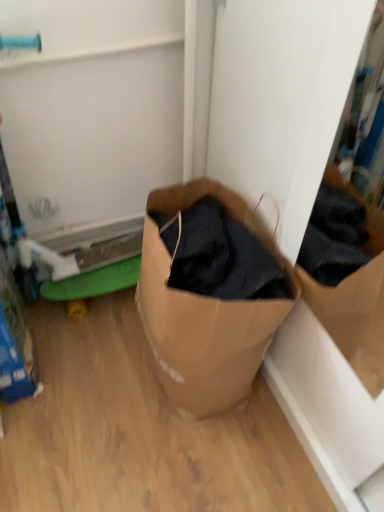
Question: Can you see brown paper bag at center touching green rubber toy at lower left?

Choices:
 (A) no
 (B) yes

Answer: (A)

Question: Considering the relative sizes of brown paper bag at center and green rubber toy at lower left in the image provided, is brown paper bag at center smaller than green rubber toy at lower left?

Choices:
 (A) yes
 (B) no

Answer: (B)

Question: From a real-world perspective, is brown paper bag at center physically below green rubber toy at lower left?

Choices:
 (A) yes
 (B) no

Answer: (B)

Question: Could you tell me if brown paper bag at center is turned towards green rubber toy at lower left?

Choices:
 (A) no
 (B) yes

Answer: (A)

Question: Is brown paper bag at center bigger than green rubber toy at lower left?

Choices:
 (A) no
 (B) yes

Answer: (B)

Question: From the image's perspective, is brown paper bag at center beneath green rubber toy at lower left?

Choices:
 (A) yes
 (B) no

Answer: (B)

Question: From a real-world perspective, is green rubber toy at lower left under brown paper bag at center?

Choices:
 (A) yes
 (B) no

Answer: (A)

Question: Is green rubber toy at lower left completely or partially outside of brown paper bag at center?

Choices:
 (A) no
 (B) yes

Answer: (B)

Question: Is green rubber toy at lower left next to brown paper bag at center and touching it?

Choices:
 (A) yes
 (B) no

Answer: (B)

Question: Is green rubber toy at lower left bigger than brown paper bag at center?

Choices:
 (A) yes
 (B) no

Answer: (B)

Question: Can you confirm if green rubber toy at lower left is wider than brown paper bag at center?

Choices:
 (A) no
 (B) yes

Answer: (A)

Question: From the image's perspective, is green rubber toy at lower left on top of brown paper bag at center?

Choices:
 (A) yes
 (B) no

Answer: (B)

Question: From a real-world perspective, is brown paper bag at center above or below green rubber toy at lower left?

Choices:
 (A) below
 (B) above

Answer: (B)